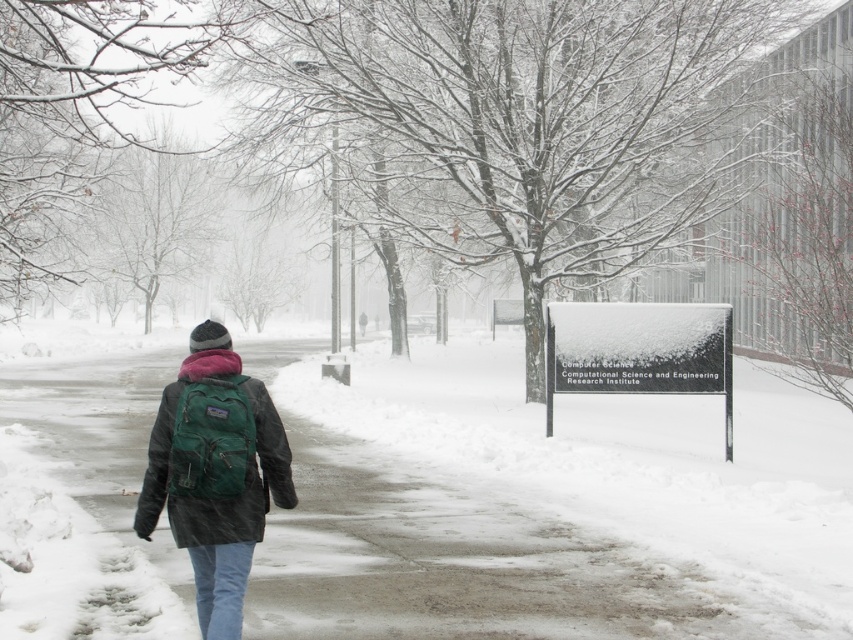
Question: Among these objects, which one is nearest to the camera?

Choices:
 (A) slick asphalt pavement at center
 (B) matte green backpack at center-left

Answer: (B)

Question: Does slick asphalt pavement at center appear on the right side of matte green backpack at center-left?

Choices:
 (A) yes
 (B) no

Answer: (B)

Question: Is slick asphalt pavement at center thinner than matte green backpack at center-left?

Choices:
 (A) no
 (B) yes

Answer: (A)

Question: Which point is farther to the camera?

Choices:
 (A) (206, 524)
 (B) (799, 532)

Answer: (B)

Question: Can you confirm if slick asphalt pavement at center is positioned to the left of matte green backpack at center-left?

Choices:
 (A) no
 (B) yes

Answer: (B)

Question: Which point is farther from the camera taking this photo?

Choices:
 (A) (199, 371)
 (B) (584, 589)

Answer: (B)